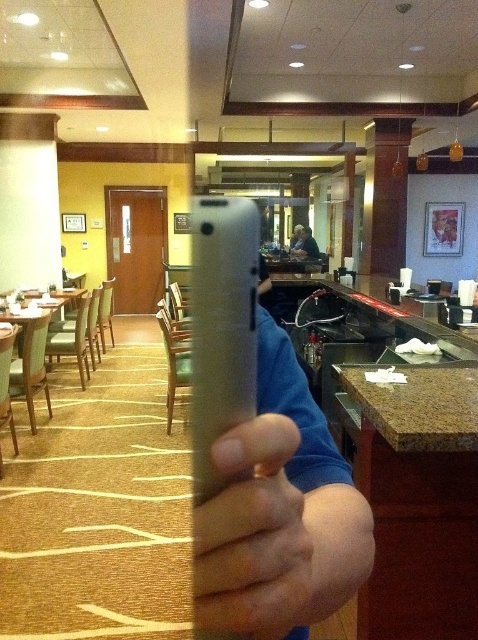
Can you confirm if matte gray phone at center is positioned to the left of blue cotton shirt at center?

Correct, you'll find matte gray phone at center to the left of blue cotton shirt at center.

The width and height of the screenshot is (478, 640). What do you see at coordinates (254, 536) in the screenshot?
I see `matte gray phone at center` at bounding box center [254, 536].

What are the coordinates of `matte gray phone at center` in the screenshot? It's located at (254, 536).